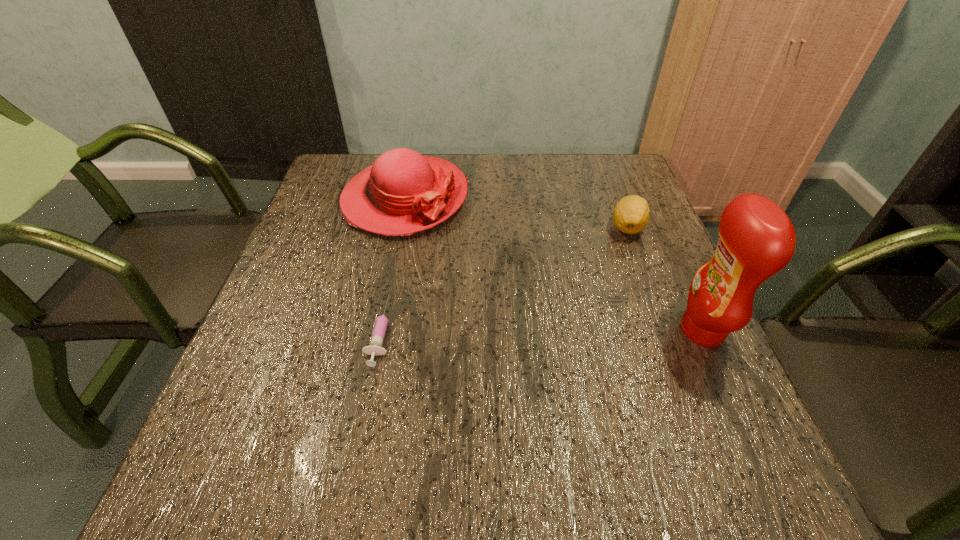
This screenshot has width=960, height=540. Identify the location of vacant space on the desktop that is between the syringe and the condiment and is positioned at the front of the hat with a bow. coord(503,330).

You are a GUI agent. You are given a task and a screenshot of the screen. Output one action in this format:
    pyautogui.click(x=<x>, y=<y>)
    Task: Click on the free spot on the desktop that is between the syringe and the condiment and is positioned at the stem end of the third tallest object
    The width and height of the screenshot is (960, 540).
    Given the screenshot: What is the action you would take?
    pyautogui.click(x=527, y=330)